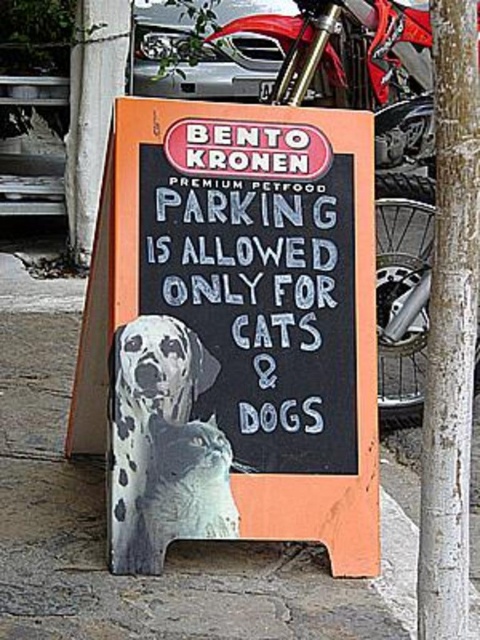
Can you confirm if white chalk/blackboard at center is shorter than spotted fur dog at center?

Incorrect, white chalk/blackboard at center's height does not fall short of spotted fur dog at center's.

Can you confirm if white chalk/blackboard at center is positioned to the right of spotted fur dog at center?

Indeed, white chalk/blackboard at center is positioned on the right side of spotted fur dog at center.

Where is `white chalk/blackboard at center`? white chalk/blackboard at center is located at coordinates (252, 292).

The image size is (480, 640). Find the location of `white chalk/blackboard at center`. white chalk/blackboard at center is located at coordinates (252, 292).

The height and width of the screenshot is (640, 480). Describe the element at coordinates (232, 330) in the screenshot. I see `orange wood sign at center` at that location.

Is orange wood sign at center thinner than white fur dog at center?

No, orange wood sign at center is not thinner than white fur dog at center.

Find the location of a particular element. This screenshot has width=480, height=640. orange wood sign at center is located at coordinates (232, 330).

Locate an element on the screen. orange wood sign at center is located at coordinates (232, 330).

Measure the distance between orange wood sign at center and spotted fur dog at center.

orange wood sign at center is 9.75 inches from spotted fur dog at center.

Is point (374, 401) positioned before point (132, 506)?

No, (374, 401) is further to viewer.

At what (x,y) coordinates should I click in order to perform the action: click on orange wood sign at center. Please return your answer as a coordinate pair (x, y). The width and height of the screenshot is (480, 640). Looking at the image, I should click on (232, 330).